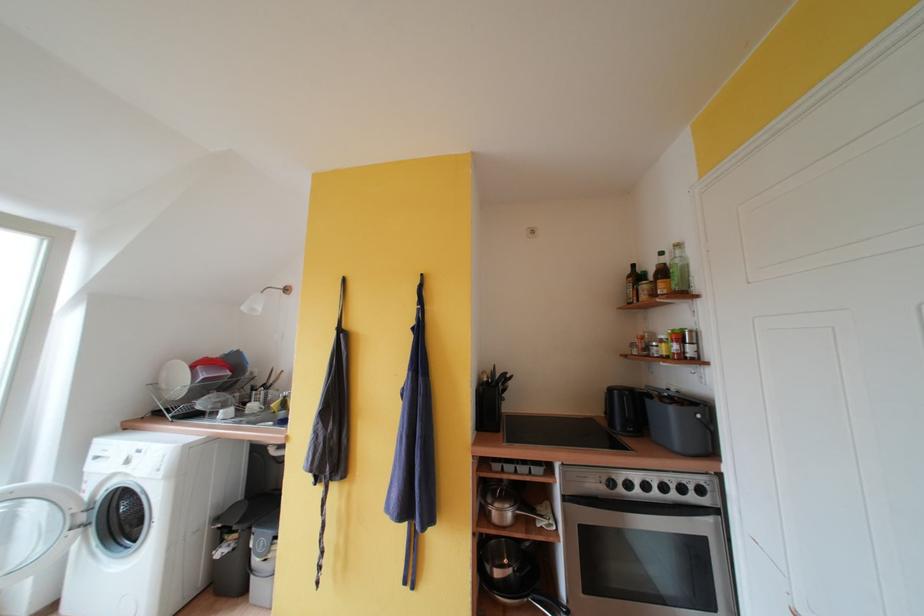
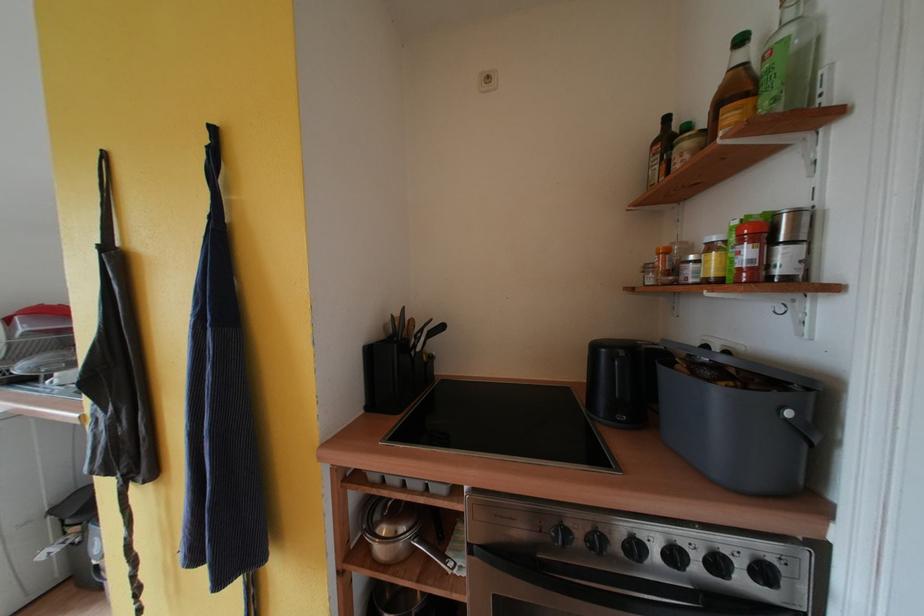
In the second image, find the point that corresponds to (x=506, y=439) in the first image.

(399, 426)